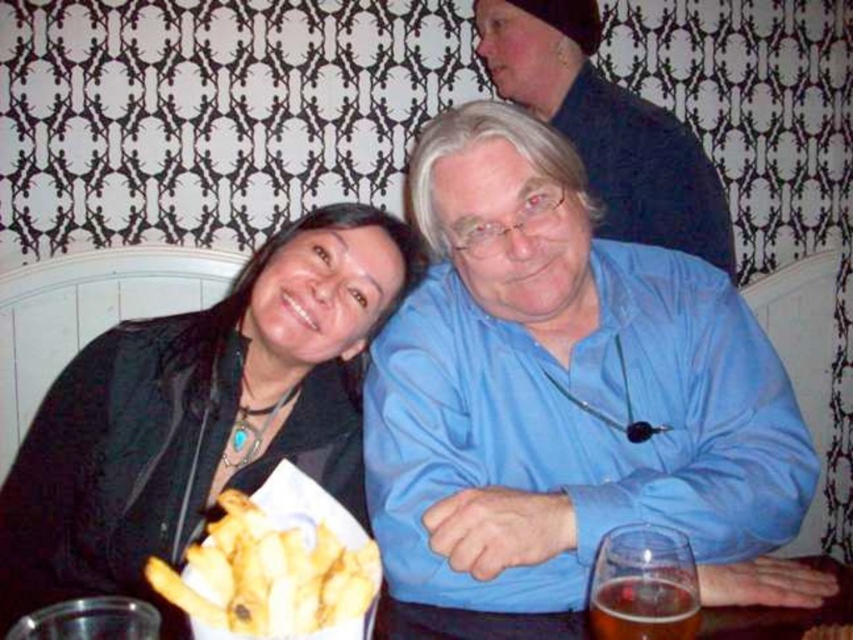
Question: Which object is closer to the camera taking this photo?

Choices:
 (A) translucent glass beer at lower center
 (B) black leather jacket at upper left

Answer: (A)

Question: From the image, what is the correct spatial relationship of blue satin shirt at center in relation to golden crispy fries at lower left?

Choices:
 (A) below
 (B) above

Answer: (B)

Question: In this image, where is black leather jacket at upper left located relative to matte black jacket at upper center?

Choices:
 (A) above
 (B) below

Answer: (B)

Question: Is black leather jacket at upper left behind golden crispy fries at lower left?

Choices:
 (A) yes
 (B) no

Answer: (A)

Question: Which object is farther from the camera taking this photo?

Choices:
 (A) black leather jacket at upper left
 (B) translucent glass beer at lower center
 (C) golden crispy fries at lower left
 (D) blue satin shirt at center

Answer: (A)

Question: Among these points, which one is nearest to the camera?

Choices:
 (A) (244, 426)
 (B) (606, 163)
 (C) (616, 314)

Answer: (C)